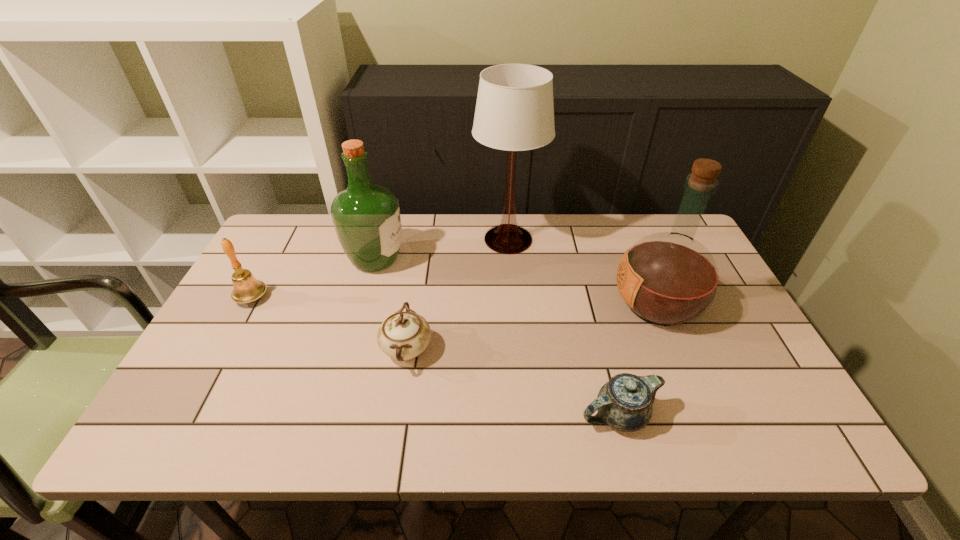
At what (x,y) coordinates should I click in order to perform the action: click on blank space located from the spout of the nearer chinaware. Please return your answer as a coordinate pair (x, y). The image size is (960, 540). Looking at the image, I should click on (517, 415).

Identify the location of table lamp that is positioned at the far edge. This screenshot has width=960, height=540. (514, 111).

The width and height of the screenshot is (960, 540). I want to click on liquor present at the far edge, so click(366, 217).

The height and width of the screenshot is (540, 960). Identify the location of object present at the near edge. (625, 402).

Image resolution: width=960 pixels, height=540 pixels. Identify the location of object positioned at the left edge. (246, 289).

What are the coordinates of `object positioned at the right edge` in the screenshot? It's located at (668, 279).

Locate an element on the screen. The height and width of the screenshot is (540, 960). vacant area at the far edge is located at coordinates (572, 261).

This screenshot has height=540, width=960. Identify the location of vacant space at the near edge of the desktop. (656, 410).

In the image, there is a desktop. Identify the location of vacant space at the left edge. (252, 386).

This screenshot has width=960, height=540. I want to click on vacant region at the right edge of the desktop, so pyautogui.click(x=726, y=350).